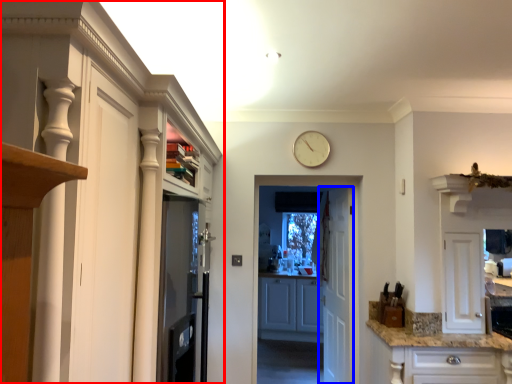
Question: Which of the following is the closest to the observer, cabinetry (highlighted by a red box) or door (highlighted by a blue box)?

Choices:
 (A) cabinetry
 (B) door

Answer: (A)